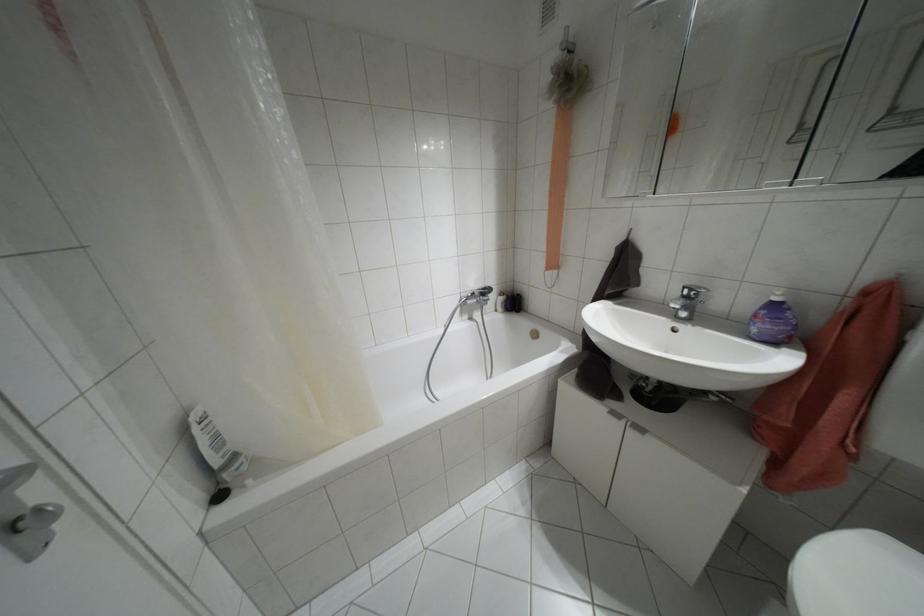
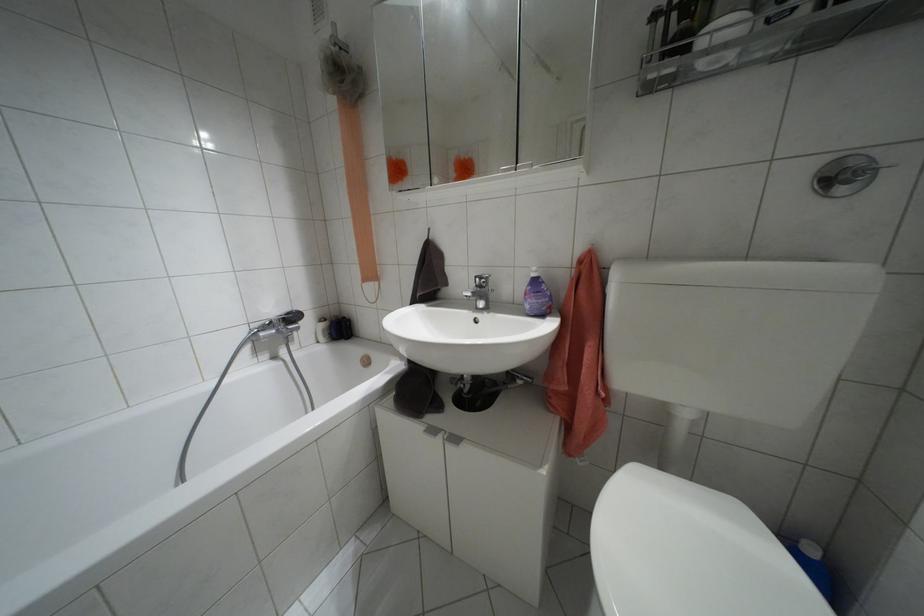
Find the pixel in the second image that matches (482,288) in the first image.

(286, 313)